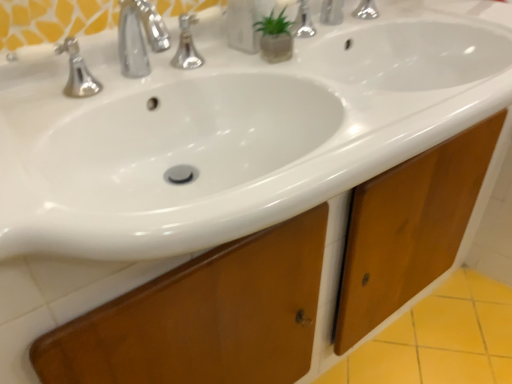
Where is `vacant area on top of white glossy sink at center (from a real-world perspective)`? vacant area on top of white glossy sink at center (from a real-world perspective) is located at coordinates (245, 67).